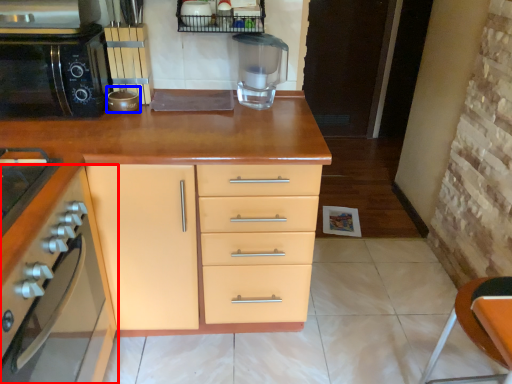
Question: Which point is closer to the camera, cabinetry (highlighted by a red box) or appliance (highlighted by a blue box)?

Choices:
 (A) cabinetry
 (B) appliance

Answer: (A)